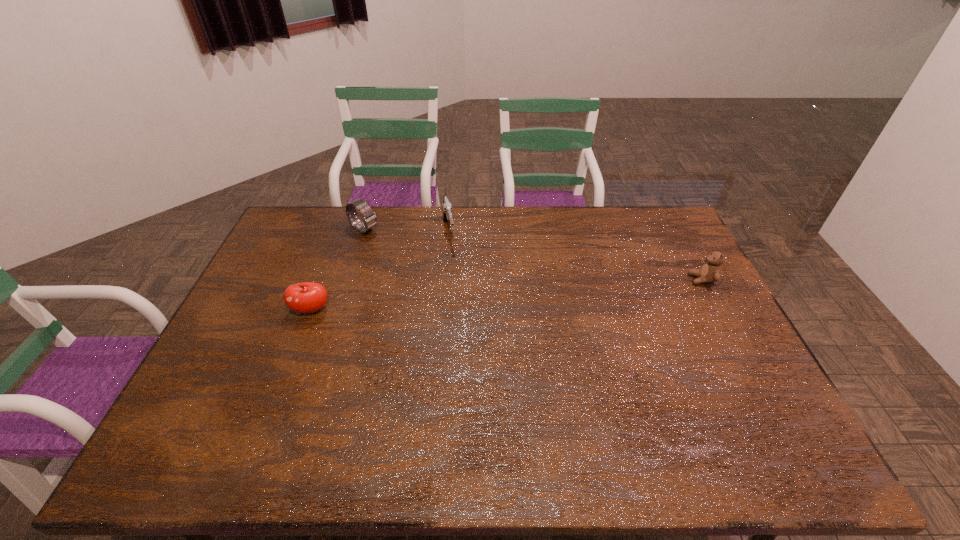
This screenshot has height=540, width=960. In the image, there is a desktop. Identify the location of vacant area at the near edge. (343, 400).

Locate an element on the screen. The width and height of the screenshot is (960, 540). vacant space at the left edge is located at coordinates pos(229,365).

In the image, there is a desktop. At what (x,y) coordinates should I click in order to perform the action: click on free space at the right edge. Please return your answer as a coordinate pair (x, y). This screenshot has height=540, width=960. Looking at the image, I should click on (684, 330).

The width and height of the screenshot is (960, 540). I want to click on free spot at the far left corner of the desktop, so click(x=324, y=210).

The width and height of the screenshot is (960, 540). Find the location of `free space at the near left corner of the desktop`. free space at the near left corner of the desktop is located at coordinates (208, 392).

At what (x,y) coordinates should I click in order to perform the action: click on vacant region between the third object from left to right and the watch. Please return your answer as a coordinate pair (x, y). The image size is (960, 540). Looking at the image, I should click on (406, 231).

Locate an element on the screen. free space between the teddy bear and the nearest object is located at coordinates (507, 295).

The height and width of the screenshot is (540, 960). Identify the location of free space between the nearest object and the rightmost object. (507, 295).

Locate an element on the screen. free space that is in between the second object from right to left and the rightmost object is located at coordinates (575, 255).

This screenshot has height=540, width=960. I want to click on vacant space that is in between the third object from left to right and the apple, so click(x=380, y=271).